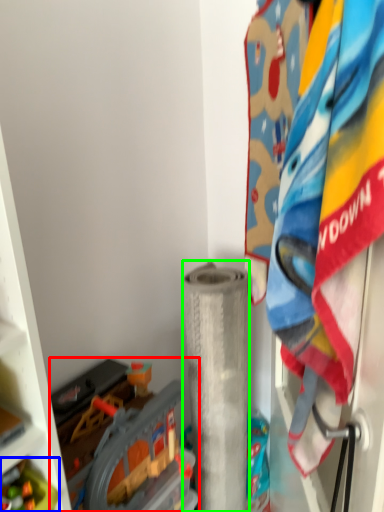
Question: Which is farther away from toy (highlighted by a red box)? toy (highlighted by a blue box) or toilet paper (highlighted by a green box)?

Choices:
 (A) toy
 (B) toilet paper

Answer: (A)